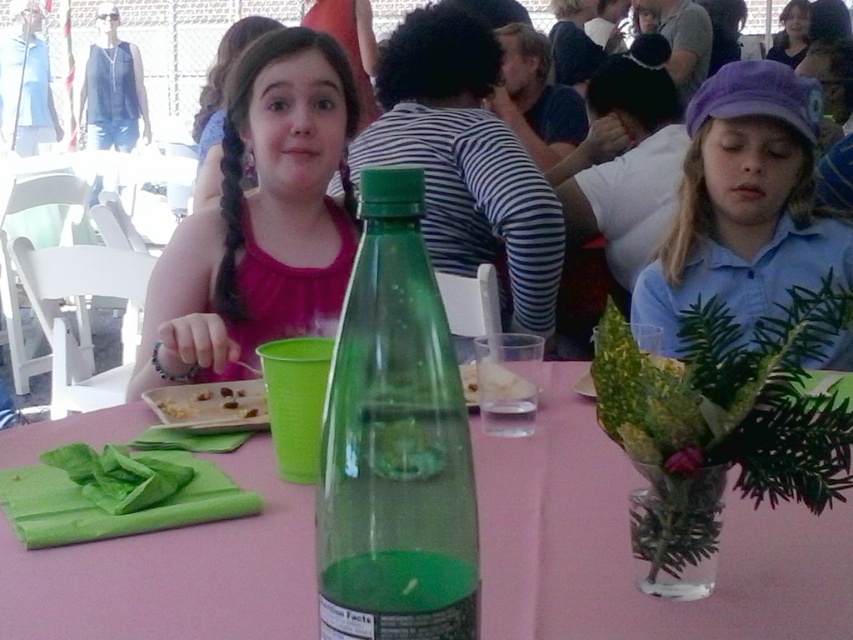
Is green translucent bottle at center above purple cotton cap at upper right?

Incorrect, green translucent bottle at center is not positioned above purple cotton cap at upper right.

Does green translucent bottle at center have a smaller size compared to purple cotton cap at upper right?

Correct, green translucent bottle at center occupies less space than purple cotton cap at upper right.

Does point (409, 195) come in front of point (770, 122)?

Yes.

You are a GUI agent. You are given a task and a screenshot of the screen. Output one action in this format:
    pyautogui.click(x=<x>, y=<y>)
    Task: Click on the green translucent bottle at center
    
    Given the screenshot: What is the action you would take?
    pyautogui.click(x=395, y=444)

Is matte green bottle at center bigger than matte black shirt at upper right?

Correct, matte green bottle at center is larger in size than matte black shirt at upper right.

Can you confirm if matte green bottle at center is positioned below matte black shirt at upper right?

Correct, matte green bottle at center is located below matte black shirt at upper right.

Where is `matte green bottle at center`? The image size is (853, 640). matte green bottle at center is located at coordinates tap(465, 160).

Between white crumbly food at center and matte black shirt at upper right, which one is positioned lower?

white crumbly food at center is below.

Does white crumbly food at center have a smaller size compared to matte black shirt at upper right?

Indeed, white crumbly food at center has a smaller size compared to matte black shirt at upper right.

Does point (463, 374) lie in front of point (807, 6)?

Yes.

At what (x,y) coordinates should I click in order to perform the action: click on white crumbly food at center. Please return your answer as a coordinate pair (x, y). The width and height of the screenshot is (853, 640). Looking at the image, I should click on (494, 381).